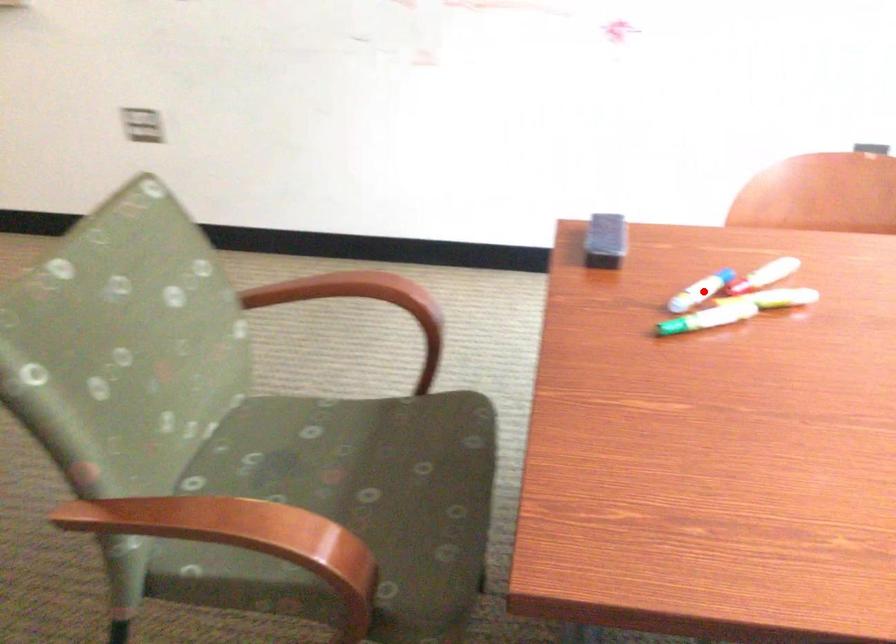
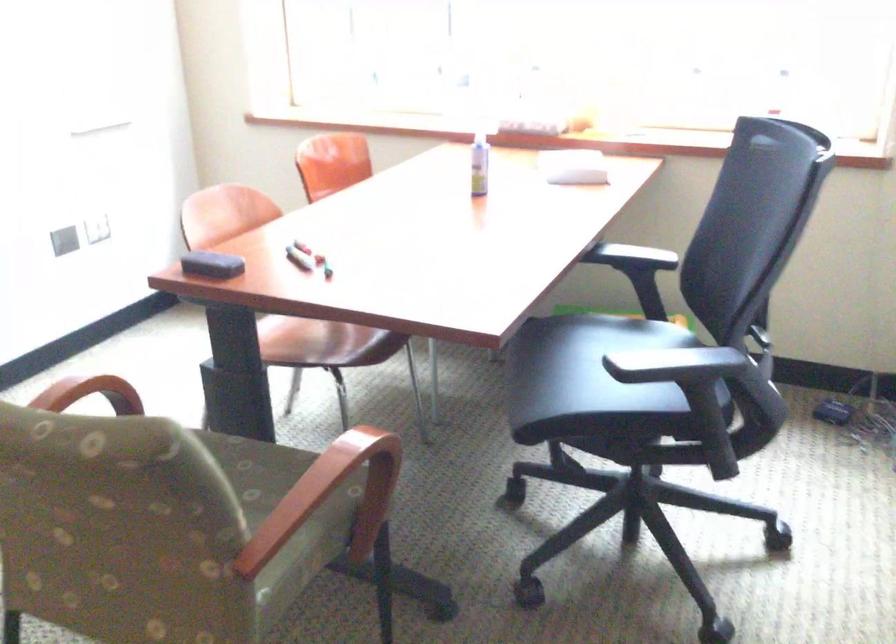
Locate, in the second image, the point that corresponds to the highlighted location in the first image.

(299, 258)